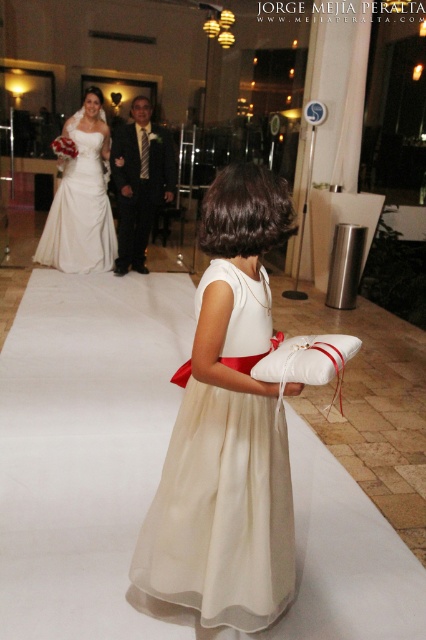
Question: Where is matte white dress at center located in relation to shiny black suit at center in the image?

Choices:
 (A) left
 (B) right

Answer: (A)

Question: Which object is the closest to the shiny black suit at center?

Choices:
 (A) ivory satin dress at center
 (B) matte white dress at center

Answer: (B)

Question: Is ivory satin dress at center closer to the viewer compared to shiny black suit at center?

Choices:
 (A) yes
 (B) no

Answer: (A)

Question: Estimate the real-world distances between objects in this image. Which object is closer to the ivory satin dress at center?

Choices:
 (A) matte white dress at center
 (B) shiny black suit at center

Answer: (B)

Question: Can you confirm if ivory satin dress at center is wider than matte white dress at center?

Choices:
 (A) no
 (B) yes

Answer: (A)

Question: Which object appears farthest from the camera in this image?

Choices:
 (A) ivory satin dress at center
 (B) matte white dress at center

Answer: (B)